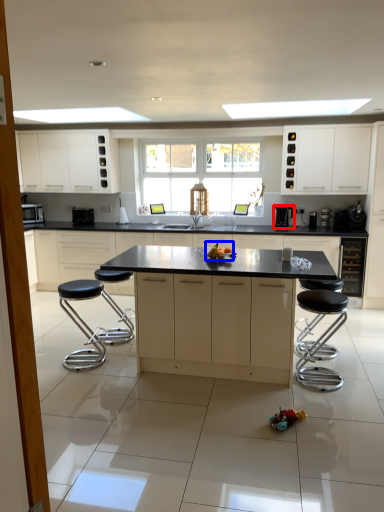
Question: Which of the following is the farthest to the observer, coffee machine (highlighted by a red box) or food (highlighted by a blue box)?

Choices:
 (A) coffee machine
 (B) food

Answer: (A)